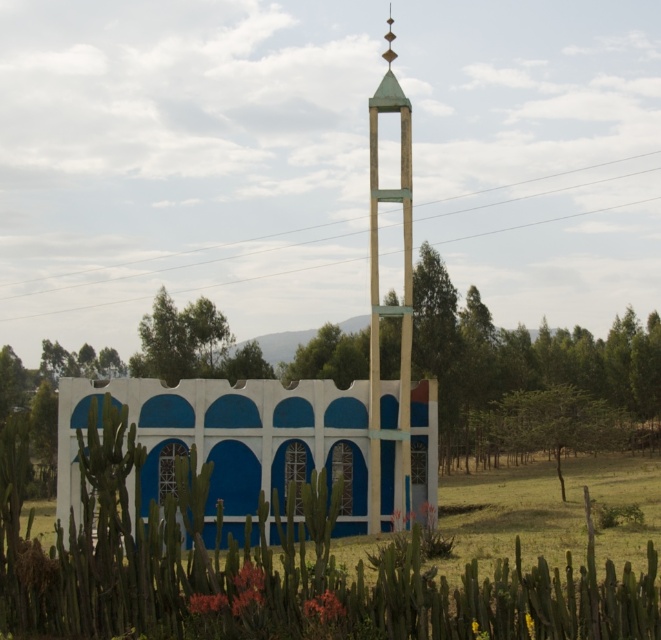
Question: Can you confirm if green spiky cactus at center is smaller than green matte tower at center?

Choices:
 (A) no
 (B) yes

Answer: (A)

Question: Is green spiky cactus at center behind blue painted concrete wall at center?

Choices:
 (A) no
 (B) yes

Answer: (A)

Question: Which object appears farthest from the camera in this image?

Choices:
 (A) green matte tower at center
 (B) blue painted concrete wall at center
 (C) green spiky cactus at center

Answer: (A)

Question: Which of the following is the closest to the observer?

Choices:
 (A) green matte tower at center
 (B) blue painted concrete wall at center

Answer: (B)

Question: In this image, where is blue painted concrete wall at center located relative to green matte tower at center?

Choices:
 (A) above
 (B) below

Answer: (B)

Question: Among these points, which one is farthest from the camera?

Choices:
 (A) (299, 410)
 (B) (408, 150)
 (C) (102, 605)

Answer: (A)